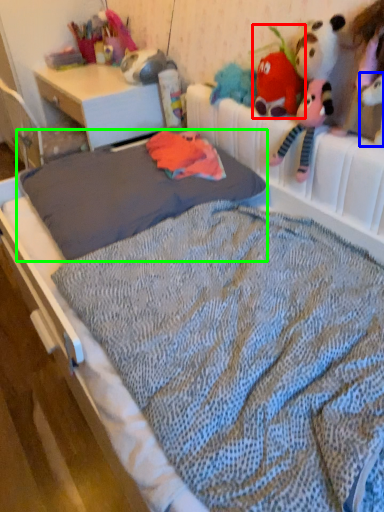
Question: Based on their relative distances, which object is nearer to toy (highlighted by a red box)? Choose from toy (highlighted by a blue box) and mattress (highlighted by a green box).

Choices:
 (A) toy
 (B) mattress

Answer: (A)